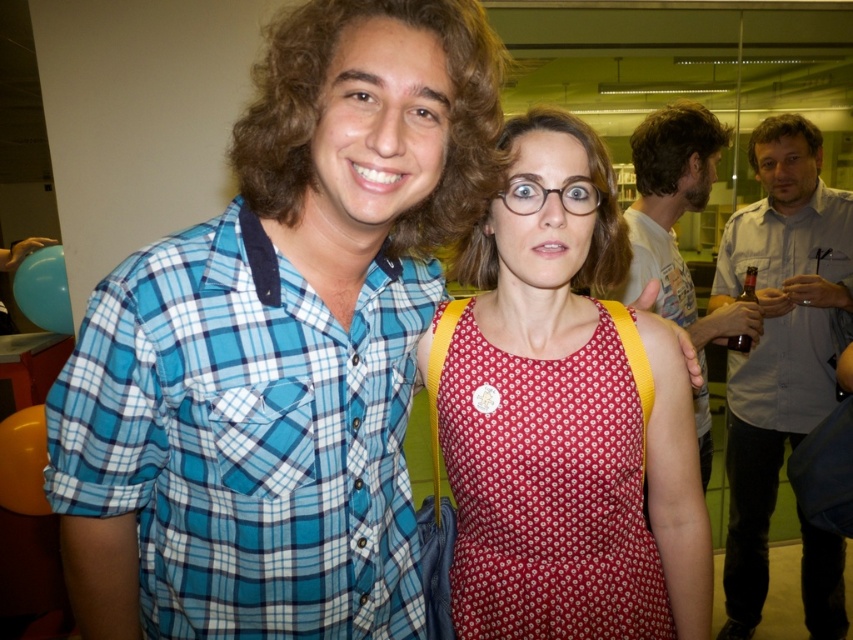
You are organizing a clothing donation drive and need to decide which shirt to place in the small donation box. The small box can only accommodate shirts with a thickness of up to 1 inch. Which shirt between the light blue plaid shirt at upper right and the matte white shirt at center should you choose?

→ The light blue plaid shirt at upper right is thinner than the matte white shirt at center, so it can fit in the small donation box.

You are standing at the camera position and want to reach point (77,433). Is the distance less than 30 inches?

The distance between point (77,433) and the camera is 27.03 inches, which is less than 30 inches.

You are at the center of the image and want to take a photo of the blue plaid shirt at left. In which direction should you move your camera to capture it in the frame?

The blue plaid shirt at left is located at point (248, 436), so you should move your camera to the left and slightly downward to capture it in the frame.